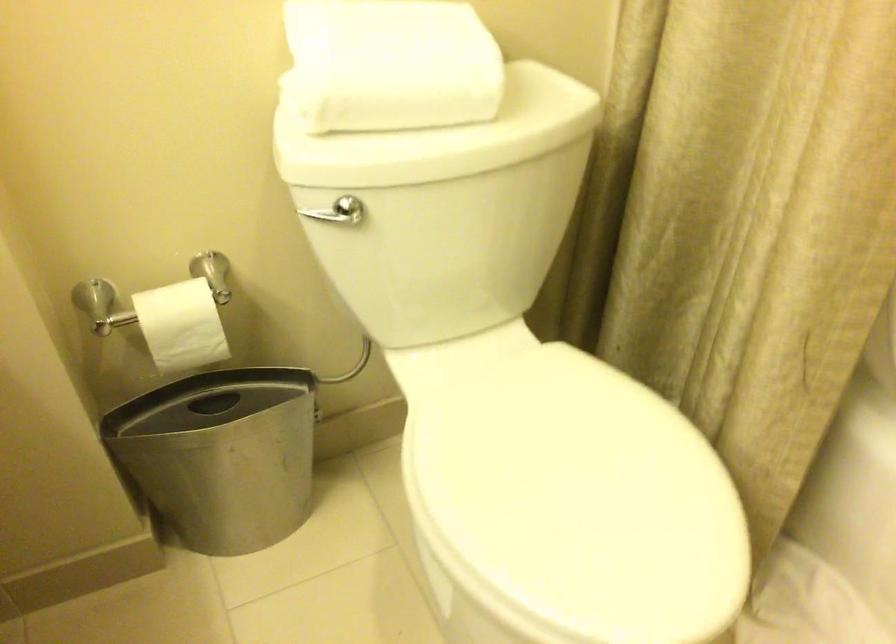
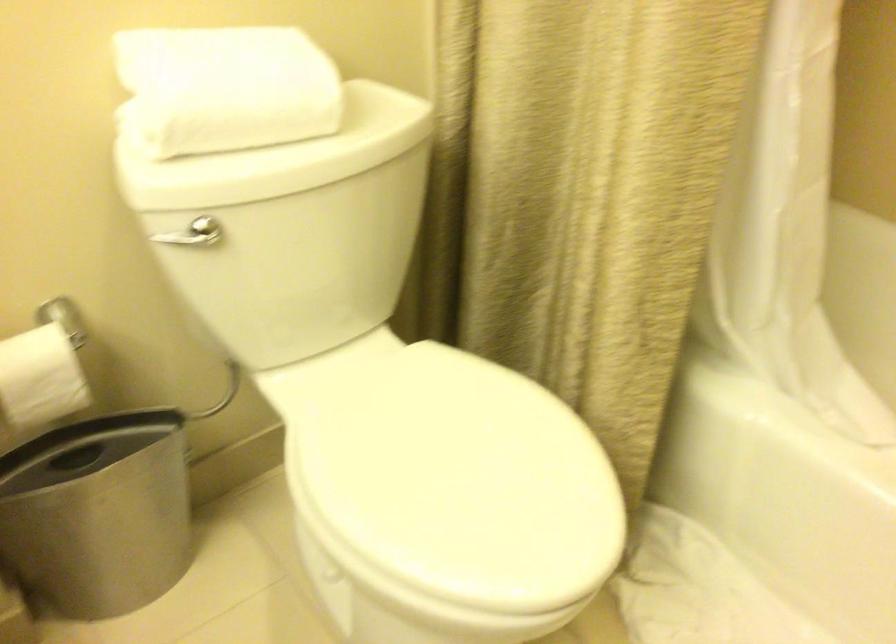
The images are taken continuously from a first-person perspective. In which direction are you moving?

The cameraman walked toward left, backward.